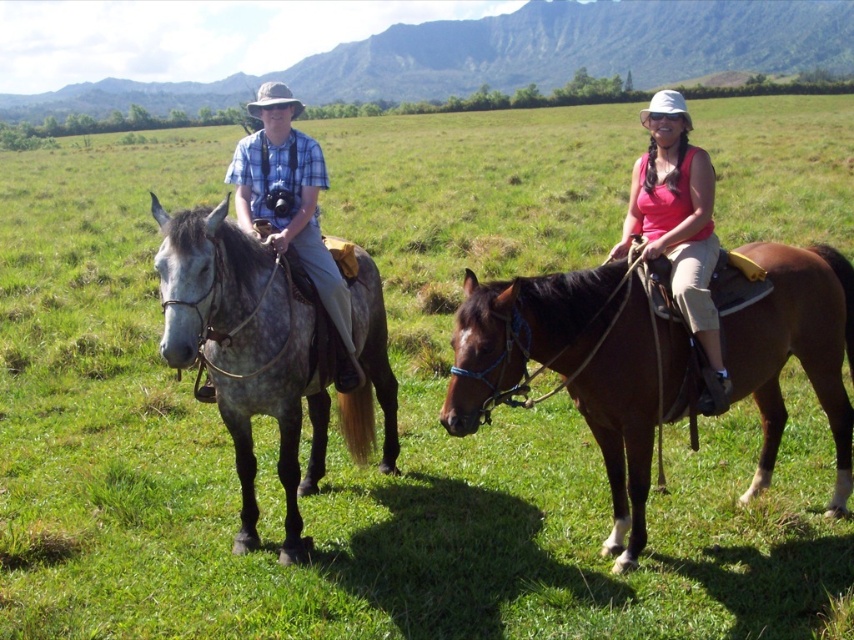
Question: Which of the following is the closest to the observer?

Choices:
 (A) brown glossy horse at center
 (B) matte pink tank top at center

Answer: (A)

Question: Which of the following is the closest to the observer?

Choices:
 (A) matte pink tank top at center
 (B) gray speckled horse at left
 (C) matte blue plaid shirt at left
 (D) brown glossy horse at center

Answer: (B)

Question: Does gray speckled horse at left have a greater width compared to matte blue plaid shirt at left?

Choices:
 (A) yes
 (B) no

Answer: (A)

Question: Can you confirm if brown glossy horse at center is positioned to the right of matte blue plaid shirt at left?

Choices:
 (A) yes
 (B) no

Answer: (A)

Question: Estimate the real-world distances between objects in this image. Which object is closer to the brown glossy horse at center?

Choices:
 (A) matte pink tank top at center
 (B) matte blue plaid shirt at left

Answer: (A)

Question: Does brown glossy horse at center have a smaller size compared to matte blue plaid shirt at left?

Choices:
 (A) no
 (B) yes

Answer: (A)